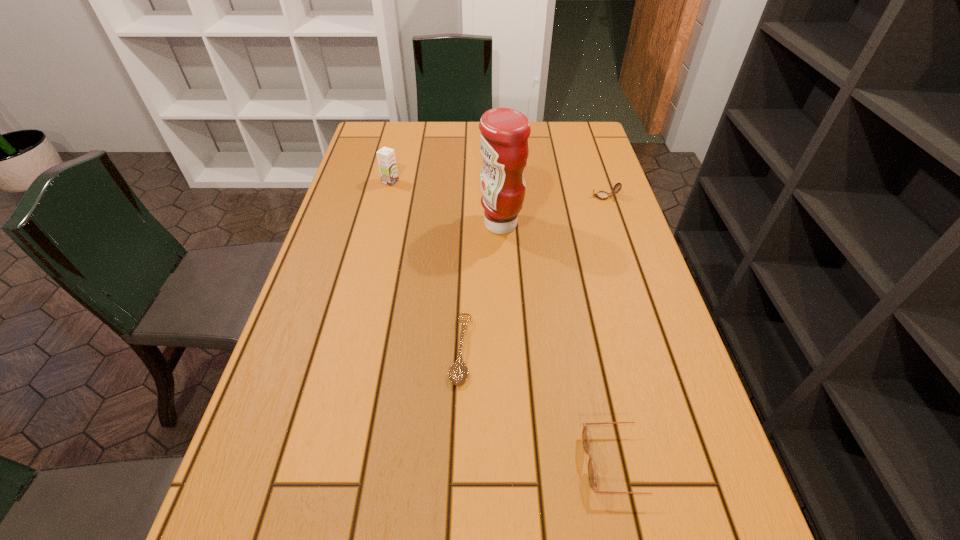
Locate an element on the screen. The image size is (960, 540). compass located at the right edge is located at coordinates (602, 195).

In order to click on sunglasses at the right edge in this screenshot , I will do (585, 436).

At what (x,y) coordinates should I click in order to perform the action: click on vacant space at the far edge of the desktop. Please return your answer as a coordinate pair (x, y). This screenshot has width=960, height=540. Looking at the image, I should click on (458, 151).

At what (x,y) coordinates should I click in order to perform the action: click on free space at the left edge of the desktop. Please return your answer as a coordinate pair (x, y). This screenshot has height=540, width=960. Looking at the image, I should click on (260, 421).

Identify the location of vacant space at the right edge. The height and width of the screenshot is (540, 960). (574, 229).

What are the coordinates of `blank space at the far left corner` in the screenshot? It's located at (387, 134).

The height and width of the screenshot is (540, 960). Find the location of `vacant space at the far right corner of the desktop`. vacant space at the far right corner of the desktop is located at coordinates (595, 138).

Locate an element on the screen. vacant region between the nearest object and the compass is located at coordinates (612, 329).

Where is `vacant region between the second tallest object and the second object from right to left`? The image size is (960, 540). vacant region between the second tallest object and the second object from right to left is located at coordinates (505, 322).

Locate an element on the screen. free space between the compass and the condiment is located at coordinates (553, 211).